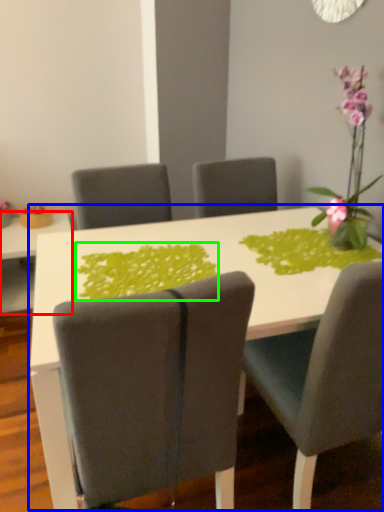
Question: Which is farther away from table (highlighted by a red box)? table (highlighted by a blue box) or design (highlighted by a green box)?

Choices:
 (A) table
 (B) design

Answer: (B)